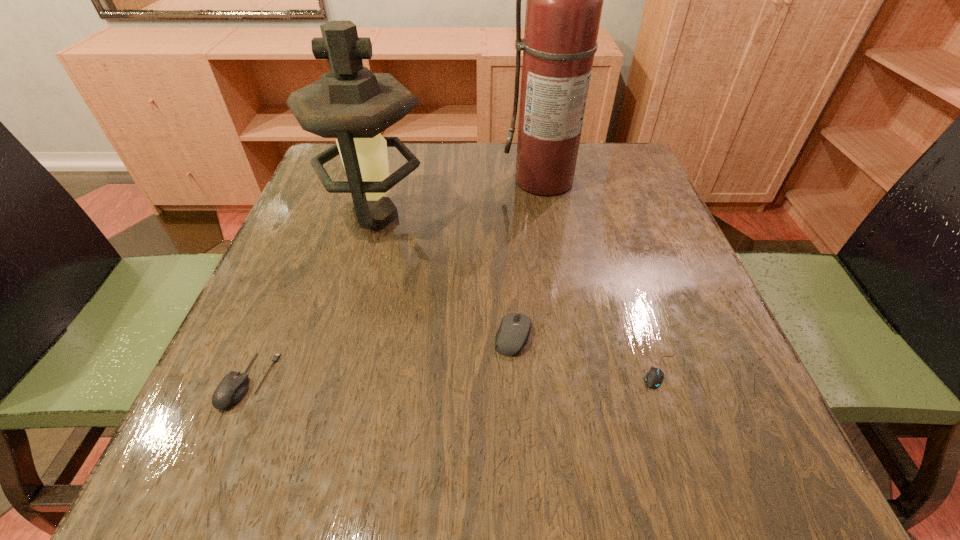
Locate an element on the screen. vacant space positioned 0.210m on the back of the tallest mouse is located at coordinates (507, 239).

Find the location of a particular element. The image size is (960, 540). free space located on the front of the leftmost mouse is located at coordinates (215, 460).

This screenshot has width=960, height=540. Find the location of `vacant space situated on the front of the rightmost mouse`. vacant space situated on the front of the rightmost mouse is located at coordinates (679, 420).

At what (x,y) coordinates should I click in order to perform the action: click on fire extinguisher located at the far edge. Please return your answer as a coordinate pair (x, y). Image resolution: width=960 pixels, height=540 pixels. Looking at the image, I should click on pos(564,0).

Where is `oil lamp situated at the far edge`? oil lamp situated at the far edge is located at coordinates (350, 103).

Where is `oil lamp that is at the left edge`? The height and width of the screenshot is (540, 960). oil lamp that is at the left edge is located at coordinates pos(350,103).

Locate an element on the screen. mouse that is positioned at the left edge is located at coordinates (232, 388).

Where is `fire extinguisher that is positioned at the right edge`? The image size is (960, 540). fire extinguisher that is positioned at the right edge is located at coordinates (564, 0).

Find the location of a particular element. Image resolution: width=960 pixels, height=540 pixels. mouse located in the right edge section of the desktop is located at coordinates (653, 378).

Where is `object present at the far left corner`? This screenshot has width=960, height=540. object present at the far left corner is located at coordinates (350, 103).